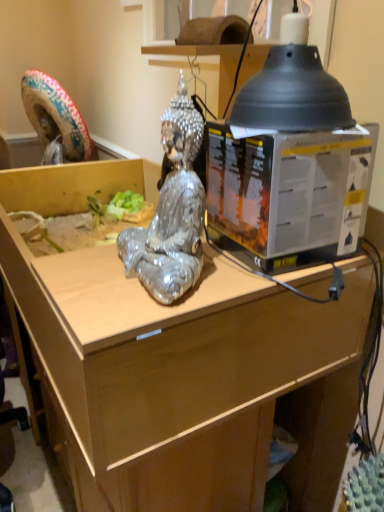
What do you see at coordinates (181, 362) in the screenshot?
I see `wooden desk at center` at bounding box center [181, 362].

Find the location of a particular element. The height and width of the screenshot is (512, 384). wooden desk at center is located at coordinates (181, 362).

In order to face metallic plastic box at center, should I rotate leftwards or rightwards?

A 10.841 degree turn to the right will do.

Locate an element on the screen. Image resolution: width=384 pixels, height=512 pixels. wooden desk at center is located at coordinates (181, 362).

Is wooden desk at center in contact with shiny metallic statue at center?

No, wooden desk at center is not with shiny metallic statue at center.

Considering the relative sizes of wooden desk at center and shiny metallic statue at center in the image provided, is wooden desk at center wider than shiny metallic statue at center?

Indeed, wooden desk at center has a greater width compared to shiny metallic statue at center.

Does wooden desk at center have a lesser height compared to shiny metallic statue at center?

Yes, wooden desk at center is shorter than shiny metallic statue at center.

Considering the points (240, 289) and (288, 161), which point is in front, point (240, 289) or point (288, 161)?

The point (288, 161) is closer to the camera.

Does wooden desk at center have a greater width compared to metallic plastic box at center?

Correct, the width of wooden desk at center exceeds that of metallic plastic box at center.

Is wooden desk at center bigger or smaller than metallic plastic box at center?

Considering their sizes, wooden desk at center takes up more space than metallic plastic box at center.

Choose the correct answer: Is wooden desk at center inside metallic plastic box at center or outside it?

wooden desk at center is spatially situated outside metallic plastic box at center.

Which is in front, point (200, 122) or point (152, 319)?

Positioned in front is point (152, 319).

From the picture: Would you say shiny metallic statue at center contains wooden desk at center?

Actually, wooden desk at center is outside shiny metallic statue at center.

Could you tell me if shiny metallic statue at center is facing wooden desk at center?

No.

Considering the sizes of shiny metallic statue at center and wooden desk at center in the image, is shiny metallic statue at center taller or shorter than wooden desk at center?

shiny metallic statue at center is taller than wooden desk at center.

From the image's perspective, between metallic plastic box at center and shiny metallic statue at center, which one is located above?

From the image's view, metallic plastic box at center is above.

You are a GUI agent. You are given a task and a screenshot of the screen. Output one action in this format:
    pyautogui.click(x=<x>, y=<y>)
    Task: Click on the box on the right of shiny metallic statue at center
    The width and height of the screenshot is (384, 512).
    Given the screenshot: What is the action you would take?
    pyautogui.click(x=288, y=191)

Which object is thinner, metallic plastic box at center or shiny metallic statue at center?

Thinner between the two is shiny metallic statue at center.

Identify the location of desk in front of the metallic plastic box at center. The height and width of the screenshot is (512, 384). (181, 362).

Considering the positions of point (296, 169) and point (187, 471), is point (296, 169) closer or farther from the camera than point (187, 471)?

Point (296, 169) is closer to the camera than point (187, 471).

Which is in front, metallic plastic box at center or wooden desk at center?

wooden desk at center is more forward.

Based on the photo, can you tell me how much shiny metallic statue at center and metallic plastic box at center differ in facing direction?

The angle between the facing direction of shiny metallic statue at center and the facing direction of metallic plastic box at center is 3.13 degrees.

Between shiny metallic statue at center and metallic plastic box at center, which one has smaller width?

Thinner between the two is shiny metallic statue at center.

Would you consider shiny metallic statue at center to be distant from metallic plastic box at center?

No, there isn't a large distance between shiny metallic statue at center and metallic plastic box at center.

The height and width of the screenshot is (512, 384). In order to click on desk behind the shiny metallic statue at center in this screenshot , I will do `click(181, 362)`.

The height and width of the screenshot is (512, 384). Identify the location of box above the wooden desk at center (from a real-world perspective). (288, 191).

When comparing their distances from shiny metallic statue at center, does wooden desk at center or metallic plastic box at center seem further?

The object further to shiny metallic statue at center is wooden desk at center.

Based on their spatial positions, is wooden desk at center or shiny metallic statue at center closer to metallic plastic box at center?

Based on the image, shiny metallic statue at center appears to be nearer to metallic plastic box at center.

In the scene shown: Which object lies nearer to the anchor point wooden desk at center, shiny metallic statue at center or metallic plastic box at center?

metallic plastic box at center lies closer to wooden desk at center than the other object.

Based on the photo, considering their positions, is metallic plastic box at center positioned closer to shiny metallic statue at center than wooden desk at center?

Based on the image, metallic plastic box at center appears to be nearer to shiny metallic statue at center.

From the image, which object appears to be nearer to wooden desk at center, metallic plastic box at center or shiny metallic statue at center?

metallic plastic box at center lies closer to wooden desk at center than the other object.

Which object lies further to the anchor point metallic plastic box at center, shiny metallic statue at center or wooden desk at center?

Among the two, wooden desk at center is located further to metallic plastic box at center.

Find the location of a particular element. The image size is (384, 512). person situated between wooden desk at center and metallic plastic box at center from left to right is located at coordinates (172, 211).